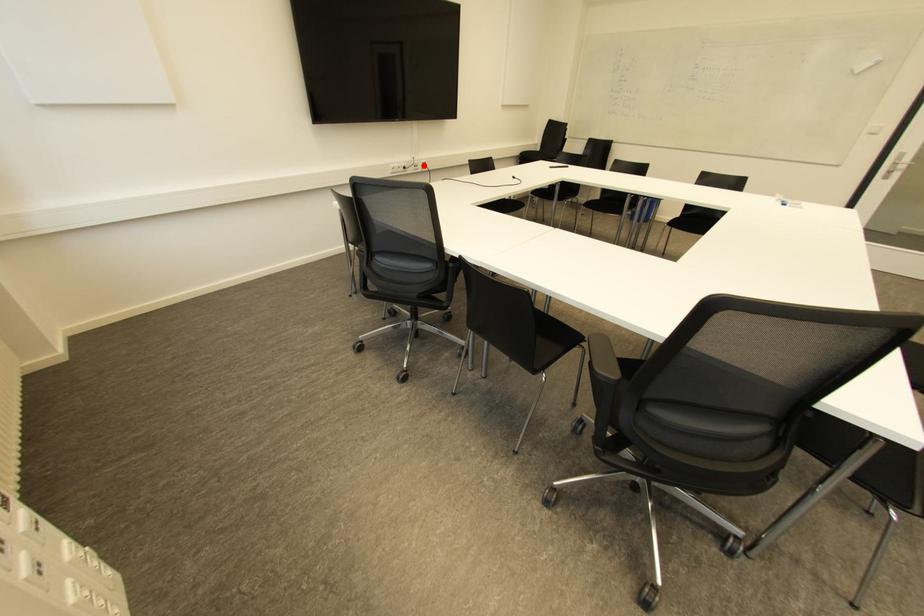
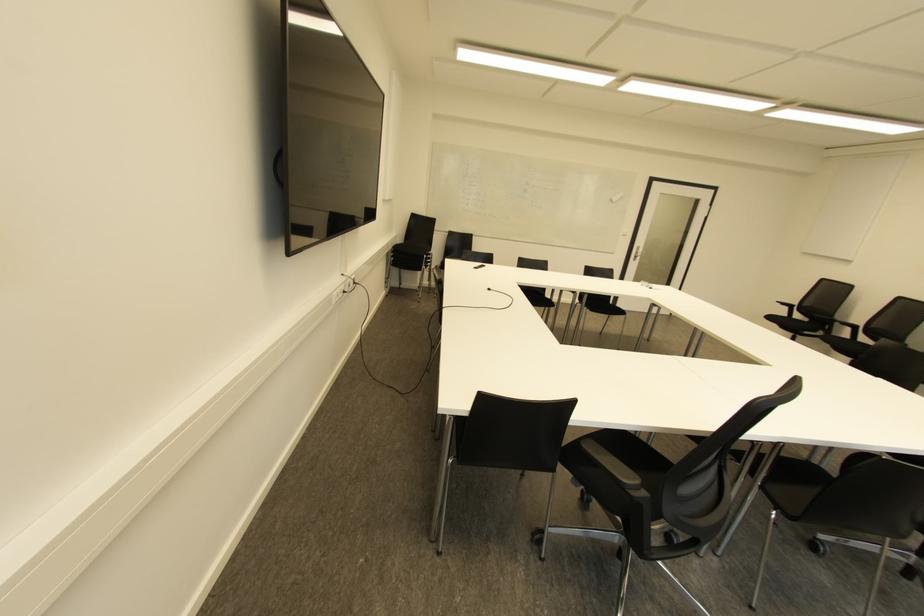
In the second image, find the point that corresponds to the highlighted location in the first image.

(354, 282)